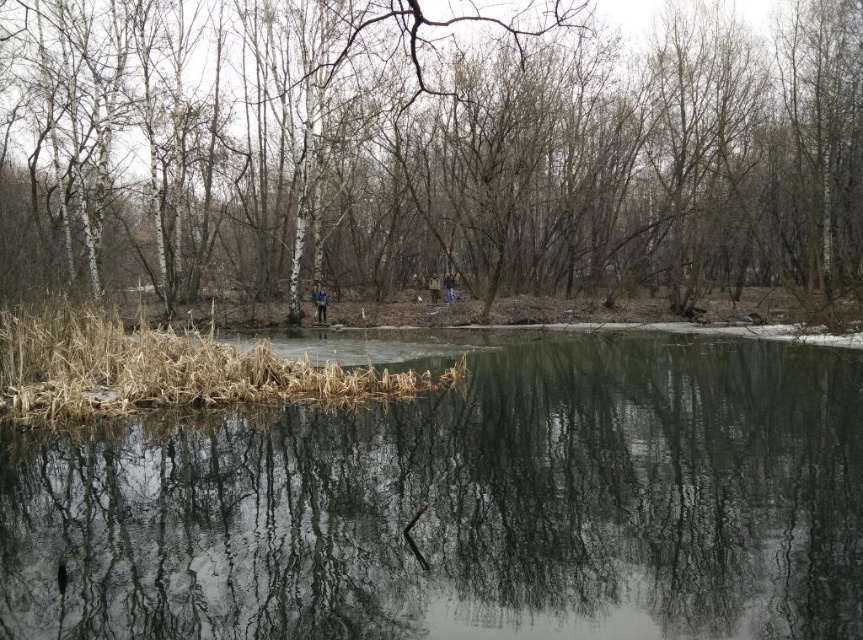
Between brown dry reed at center and blue jeans at center, which one has less height?

With less height is blue jeans at center.

Where is `brown dry reed at center`? This screenshot has width=863, height=640. brown dry reed at center is located at coordinates (x=165, y=369).

Who is more distant from viewer, (594, 257) or (118, 381)?

Point (594, 257)

Image resolution: width=863 pixels, height=640 pixels. What do you see at coordinates (427, 150) in the screenshot?
I see `brown bark tree at center` at bounding box center [427, 150].

Does point (443, 253) lie in front of point (234, 348)?

No, it is behind (234, 348).

Find the location of a particular element. brown bark tree at center is located at coordinates (427, 150).

Does transparent water at center appear on the right side of dark blue jacket at center?

Correct, you'll find transparent water at center to the right of dark blue jacket at center.

Which is more to the left, transparent water at center or dark blue jacket at center?

dark blue jacket at center is more to the left.

Does point (722, 339) lie behind point (451, 298)?

No, it is not.

Identify the location of transparent water at center. (463, 506).